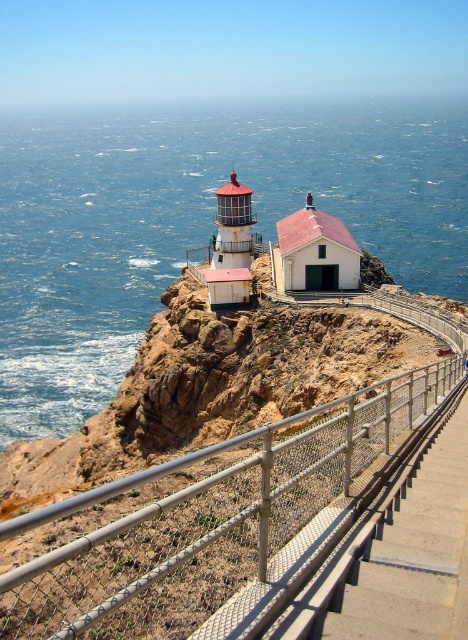
You are standing at the base of the cliff looking towards the lighthouse and the smaller building. There are two points marked on the cliff face, one at coordinates point [146,120] and the other at point [14,538]. Which point is closer to your current position?

Point [146,120] is further to the viewer than point [14,538], so the point closer to your current position is point [14,538].

You are a painter trying to capture the coastal scene. You want to ensure the blue water at upper left and the metal mesh railing at center are proportionally accurate in your painting. Which object should you make larger in your artwork?

The blue water at upper left should be made larger in the painting since it is bigger than the metal mesh railing at center according to the description.